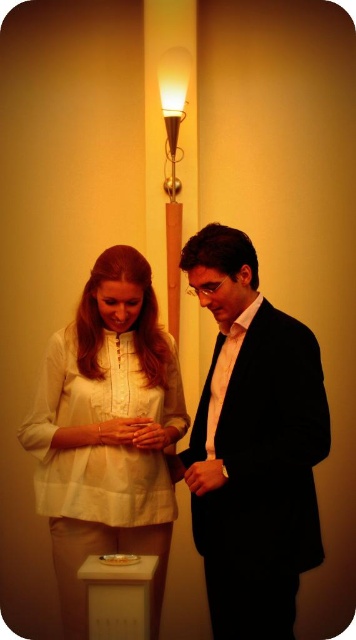
You are planning to place a new decorative item in the living room. The black satin suit at center and the matte gold lamp at upper center are already present. Which object should you avoid placing a large vase next to if you want to ensure it doesn

The black satin suit at center is bigger than the matte gold lamp at upper center, so placing a large vase next to the matte gold lamp at upper center might be more feasible since the larger black satin suit at center could already occupy more space.